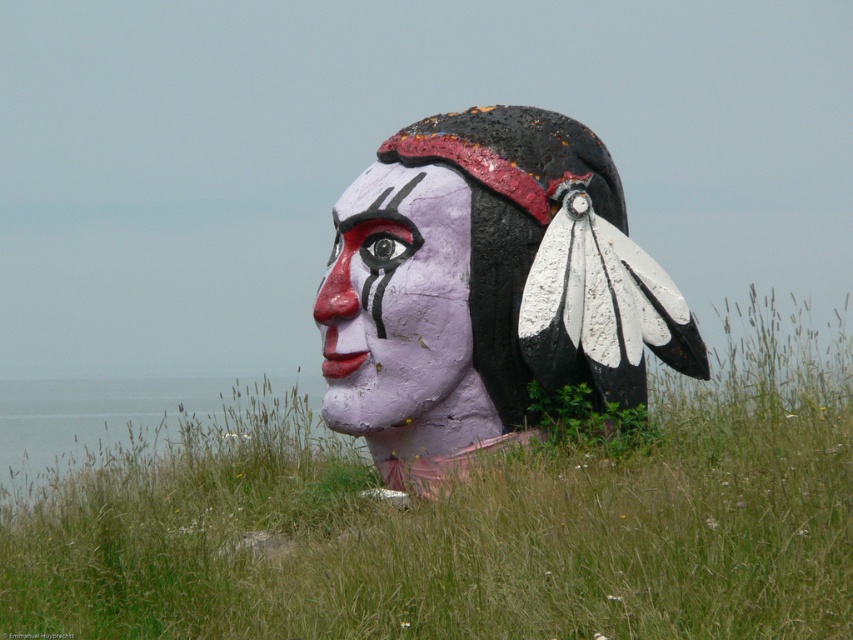
Can you confirm if matte purple head at center is smaller than matte purple mask at center?

No, matte purple head at center is not smaller than matte purple mask at center.

In the scene shown: Can you confirm if matte purple head at center is wider than matte purple mask at center?

Yes.

Describe the element at coordinates (485, 288) in the screenshot. I see `matte purple head at center` at that location.

Locate an element on the screen. The width and height of the screenshot is (853, 640). matte purple head at center is located at coordinates (485, 288).

The image size is (853, 640). I want to click on matte pink statue at center, so click(469, 520).

Between point (634, 474) and point (437, 157), which one is positioned in front?

Point (634, 474)

Where is `matte pink statue at center`? matte pink statue at center is located at coordinates (469, 520).

Locate an element on the screen. matte pink statue at center is located at coordinates pyautogui.click(x=469, y=520).

Between matte pink statue at center and matte purple mask at center, which one is positioned higher?

matte purple mask at center is above.

Looking at this image, is matte pink statue at center wider than matte purple mask at center?

Correct, the width of matte pink statue at center exceeds that of matte purple mask at center.

You are a GUI agent. You are given a task and a screenshot of the screen. Output one action in this format:
    pyautogui.click(x=<x>, y=<y>)
    Task: Click on the matte pink statue at center
    The height and width of the screenshot is (640, 853).
    Given the screenshot: What is the action you would take?
    pyautogui.click(x=469, y=520)